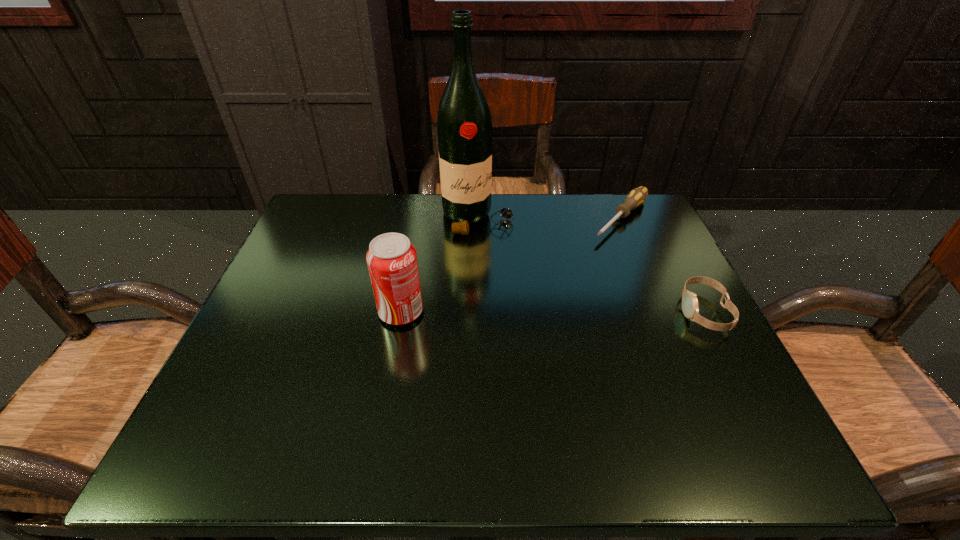
Image resolution: width=960 pixels, height=540 pixels. What are the coordinates of `free spot on the desktop that is between the leftmost object and the third tallest object and is positioned at the tip of the shortest object` in the screenshot? It's located at (528, 312).

Identify the location of free space on the desktop that is between the leftmost object and the watch and is positioned on the surface of the tallest object. The width and height of the screenshot is (960, 540). (557, 312).